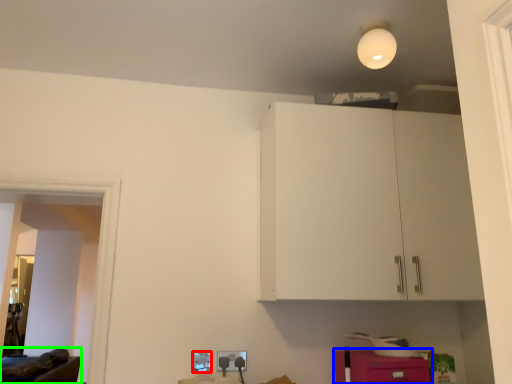
Question: Which object is the closest to the electric outlet (highlighted by a red box)? Choose among these: cabinetry (highlighted by a blue box) or furniture (highlighted by a green box).

Choices:
 (A) cabinetry
 (B) furniture

Answer: (A)